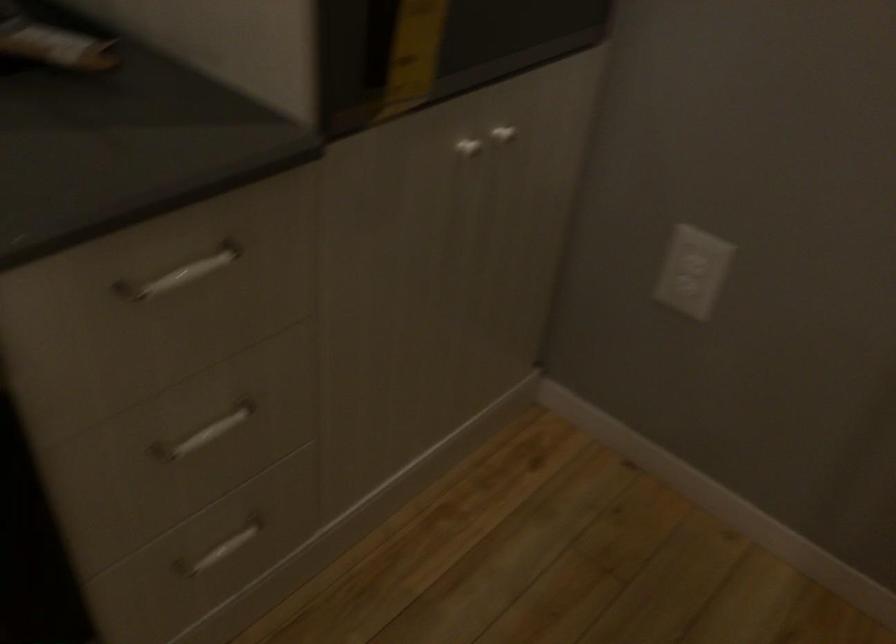
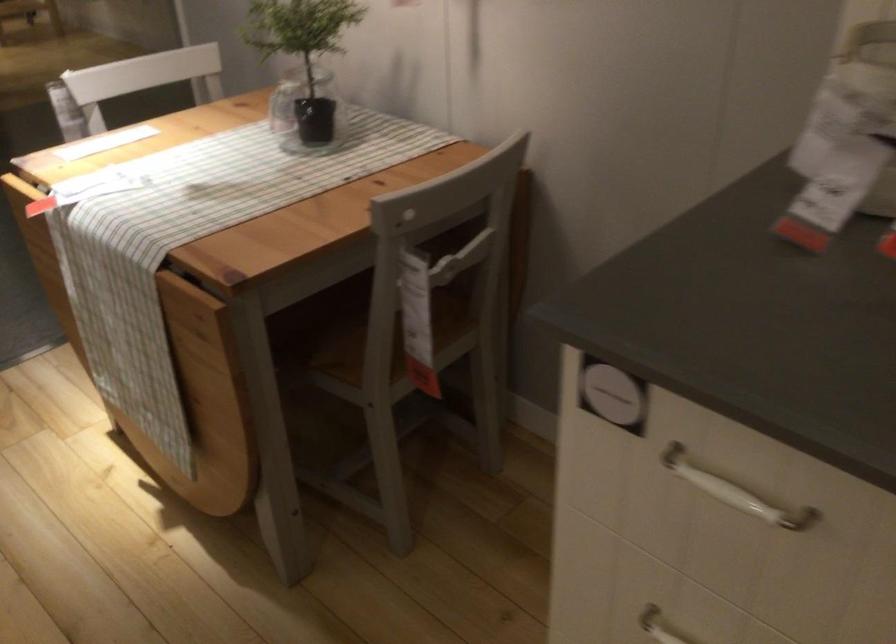
The first image is from the beginning of the video and the second image is from the end. How did the camera likely rotate when shooting the video?

The camera rotated toward left-down.